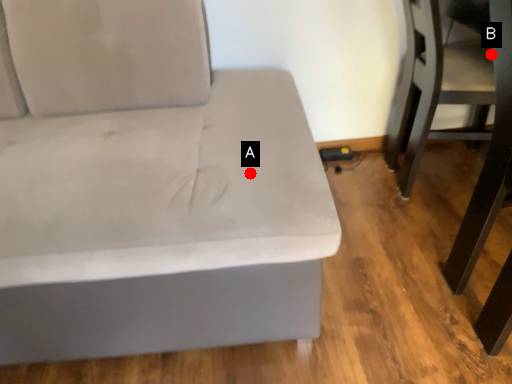
Question: Two points are circled on the image, labeled by A and B beside each circle. Which of the following is the closest to the observer?

Choices:
 (A) A is closer
 (B) B is closer

Answer: (A)